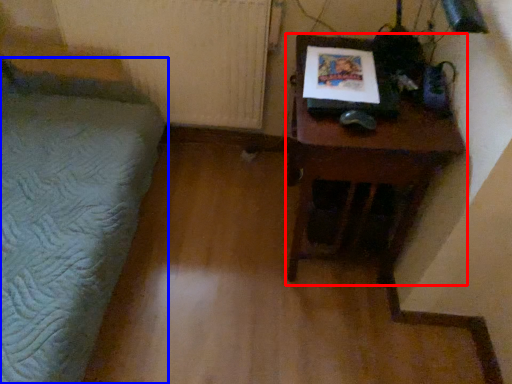
Question: Which point is further to the camera, table (highlighted by a red box) or furniture (highlighted by a blue box)?

Choices:
 (A) table
 (B) furniture

Answer: (A)